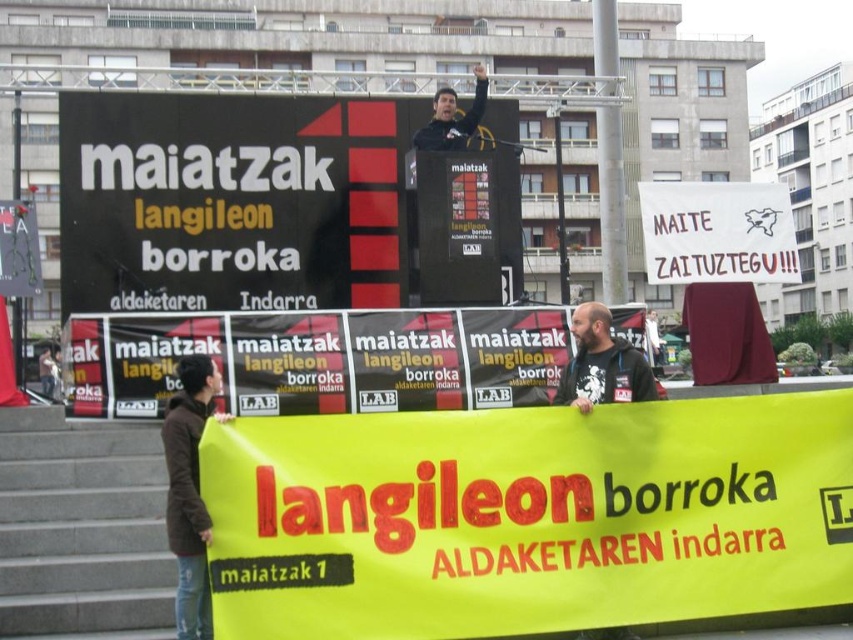
Question: Estimate the real-world distances between objects in this image. Which object is farther from the black matte scoreboard at upper center?

Choices:
 (A) dark gray t-shirt at center
 (B) brown leather jacket at lower left
 (C) yellow fabric banner at lower center

Answer: (B)

Question: Does gray concrete stairs at lower left lie in front of brown leather jacket at lower left?

Choices:
 (A) no
 (B) yes

Answer: (A)

Question: Which point is closer to the camera taking this photo?

Choices:
 (A) (180, 397)
 (B) (585, 342)
 (C) (131, 120)
 (D) (26, 490)

Answer: (A)

Question: Can you confirm if gray concrete stairs at lower left is positioned to the left of dark gray t-shirt at center?

Choices:
 (A) yes
 (B) no

Answer: (A)

Question: Is yellow fabric banner at lower center thinner than gray concrete stairs at lower left?

Choices:
 (A) yes
 (B) no

Answer: (B)

Question: Which of the following is the farthest from the observer?

Choices:
 (A) brown leather jacket at lower left
 (B) gray concrete stairs at lower left
 (C) yellow fabric banner at lower center
 (D) black matte scoreboard at upper center

Answer: (D)